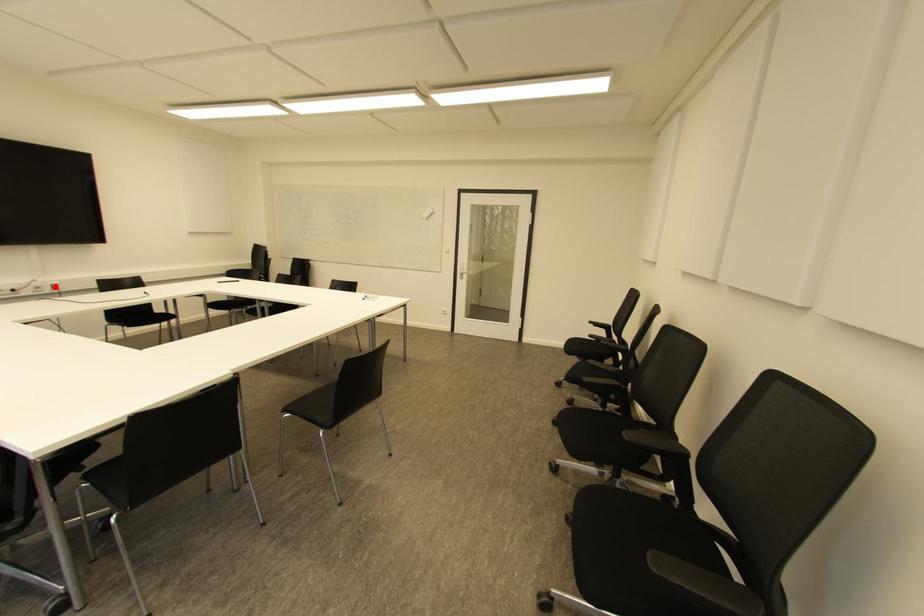
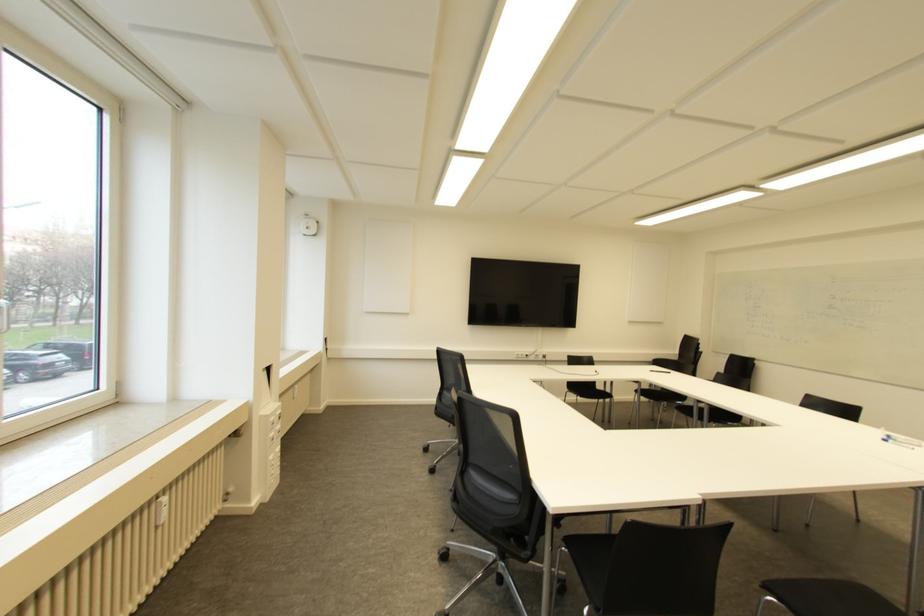
Locate, in the second image, the point that corresponds to the highlighted location in the first image.

(543, 355)